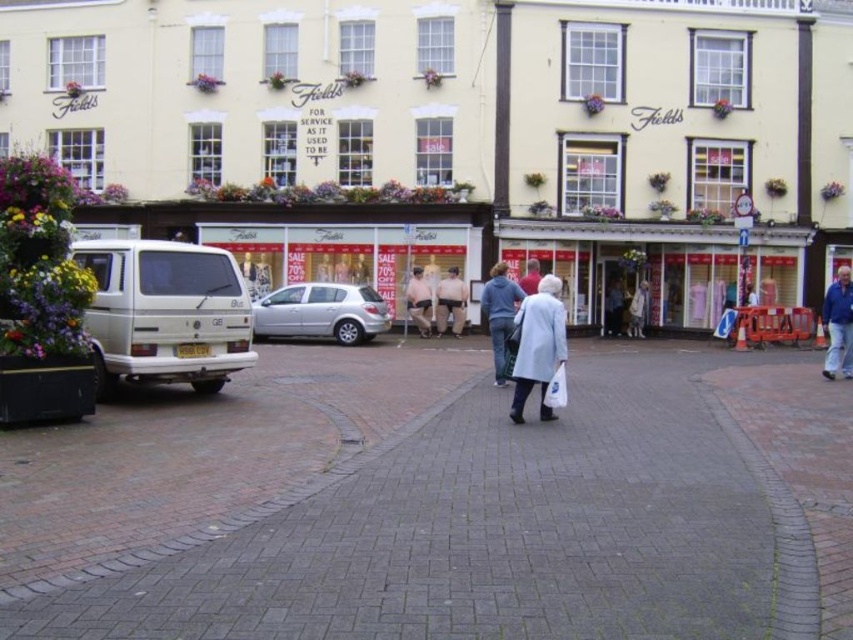
You are standing on the street in front of the Fields building. There is a point marked at coordinates (x=631, y=264). What object does this point correspond to?

The point at coordinates (x=631, y=264) corresponds to the matte glass storefront at center.

You are standing at the entrance of the Fields building and want to find the nearest parking spot. There is a car parked at point (321,312). Is this car blocking the entrance of the Fields building?

The point (321,312) is on the satin silver hatchback at center, so the car is parked at the center of the scene. Since the entrance of the Fields building is likely at the front, the car might be blocking it depending on the exact positioning. However, without more details, we can only confirm the car is centrally located.

You are a customer browsing the store window and want to pick up both the blue denim jacket at center and the light gray coat at center. Which item is easier to reach from your current position?

The blue denim jacket at center is closer to the viewer than the light gray coat at center, so it is easier to reach.